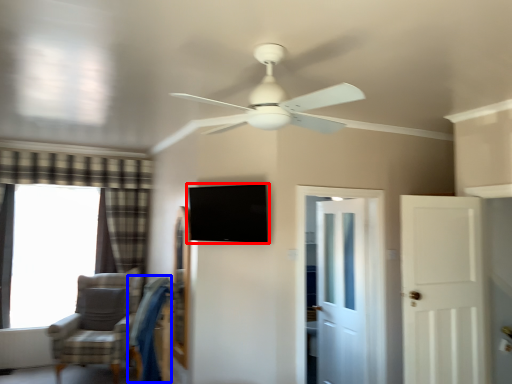
Question: Among these objects, which one is farthest to the camera, window screen (highlighted by a red box) or swivel chair (highlighted by a blue box)?

Choices:
 (A) window screen
 (B) swivel chair

Answer: (B)